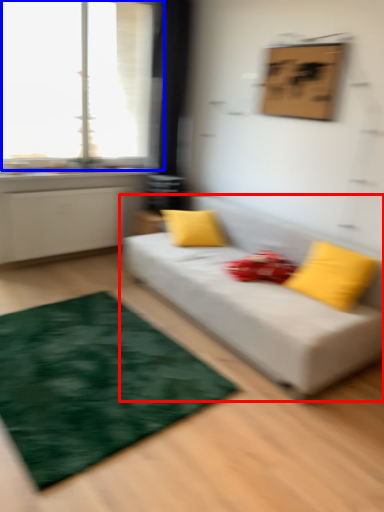
Question: Which object is closer to the camera taking this photo, studio couch (highlighted by a red box) or window (highlighted by a blue box)?

Choices:
 (A) studio couch
 (B) window

Answer: (A)